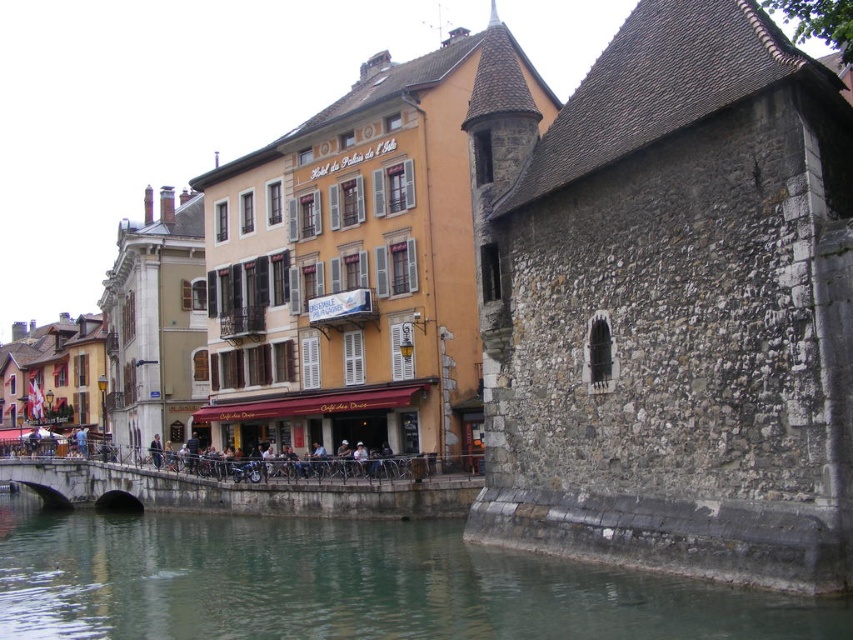
You are a tourist with a small electric scooter that has a 10 meter range. You are currently at the greenish stone water at lower left and want to reach the concrete stone bridge at lower center. Can your scooter get you there without needing to recharge?

The distance between the greenish stone water at lower left and the concrete stone bridge at lower center is 9.76 meters. Since your scooter has a 10 meter range, it can easily cover the distance without needing to recharge.

Based on the photo, you are standing at the riverside in front of the historic stone building on the right and the vibrant yellow orange building with white shutters on the left. You want to take a photo of the point at coordinates (24,586). Is this point within your camera frame if your camera has a maximum focus distance of 150 feet?

The point at coordinates (24,586) is 175.43 feet away from the camera. Since the maximum focus distance is 150 feet, the camera cannot focus on this point. You will need to move closer or use a different camera with a longer range.

You are a tourist standing on the riverside path and want to take a photo of the greenish stone water at lower left and the concrete stone bridge at lower center. Which object will appear taller in your photo?

The greenish stone water at lower left will appear taller in the photo because it has a greater height compared to the concrete stone bridge at lower center.